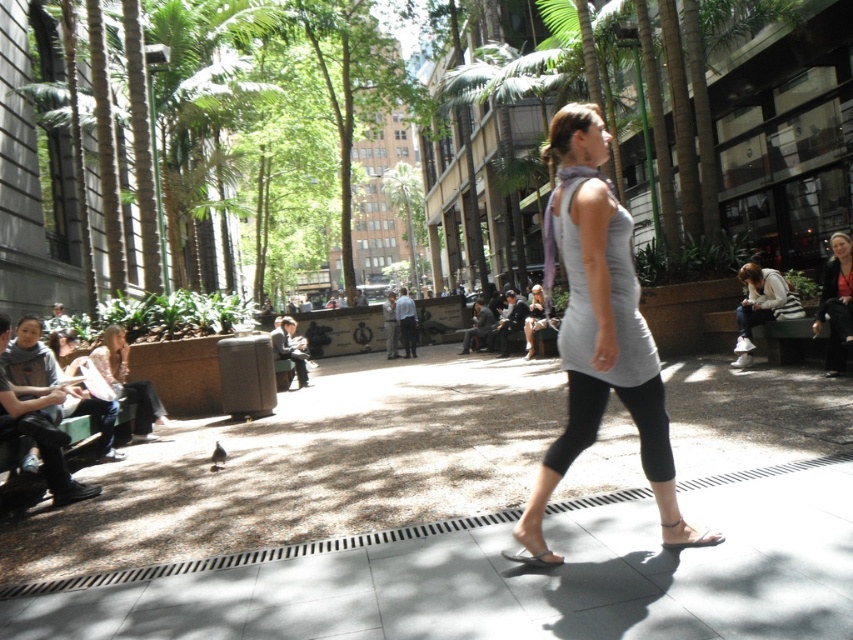
You are a photographer standing at the edge of the park. You see a point at coordinates (289, 348). What object is located at that point?

The point at coordinates (289, 348) corresponds to the dark gray fabric jacket at center.

You are a photographer standing in the park and want to take a photo of the dark gray pants at center and the light gray fabric jacket at center. Which object should you focus on first to ensure both are in focus?

You should focus on the dark gray pants at center first since it is closer to the viewer than the light gray fabric jacket at center, so adjusting focus from near to far will help both be in focus.

You are a photographer aiming to capture the woman walking in the park. You want to ensure both the dark gray fabric jacket at center and the white leather sandal at lower center are clearly visible in the photo. Which object should you focus on first to ensure it doesn t get cropped out?

The dark gray fabric jacket at center is much taller than the white leather sandal at lower center, so you should focus on ensuring the dark gray fabric jacket at center is fully visible first since it takes up more vertical space in the frame.